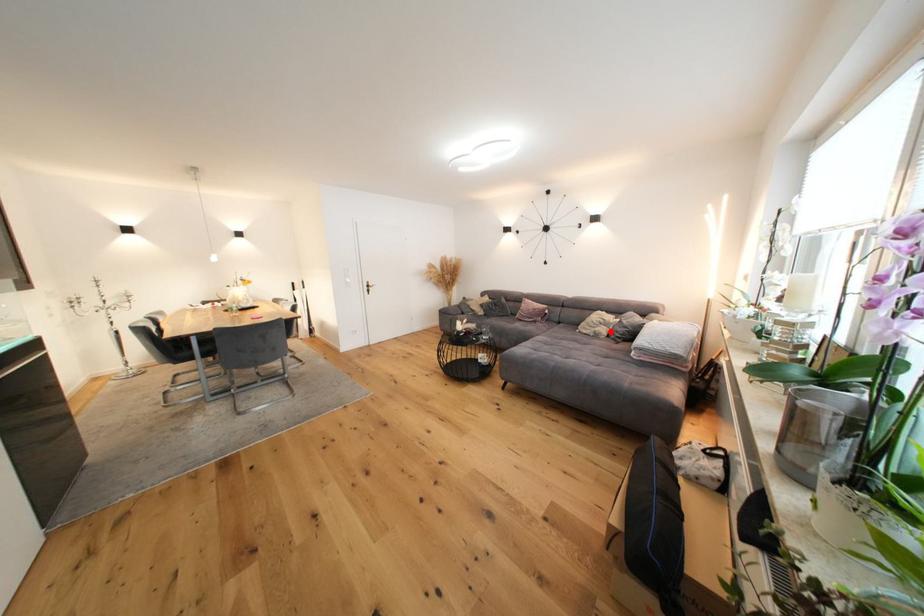
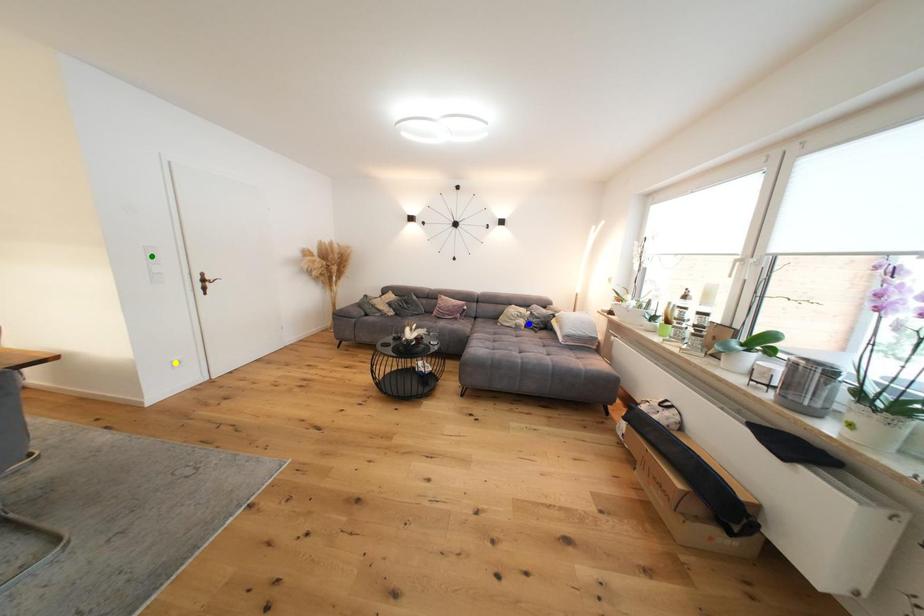
Question: I am providing you with two images of the same scene from different viewpoints. A red point is marked on the first image. You are given multiple points on the second image. Which mark in image 2 goes with the point in image 1?

Choices:
 (A) blue point
 (B) yellow point
 (C) green point

Answer: (A)